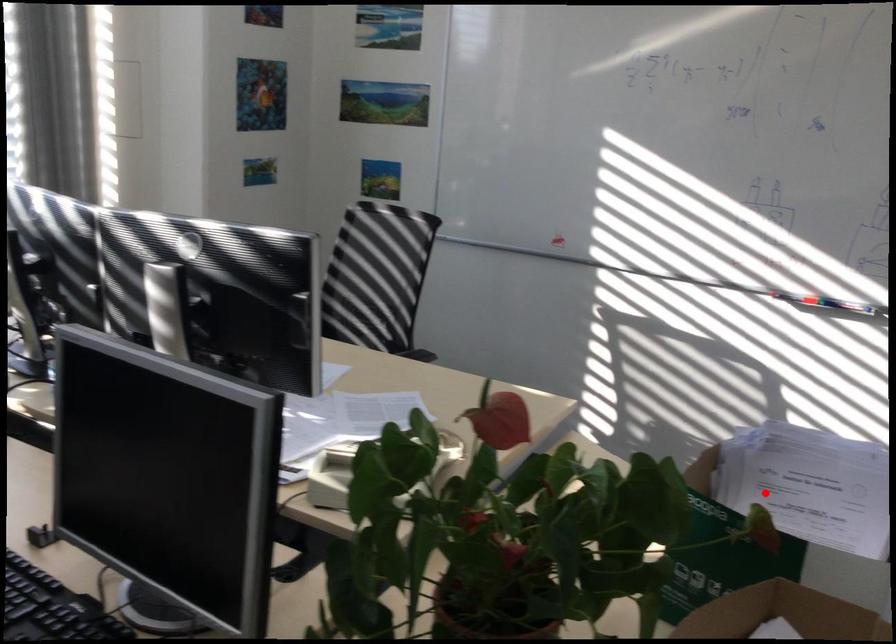
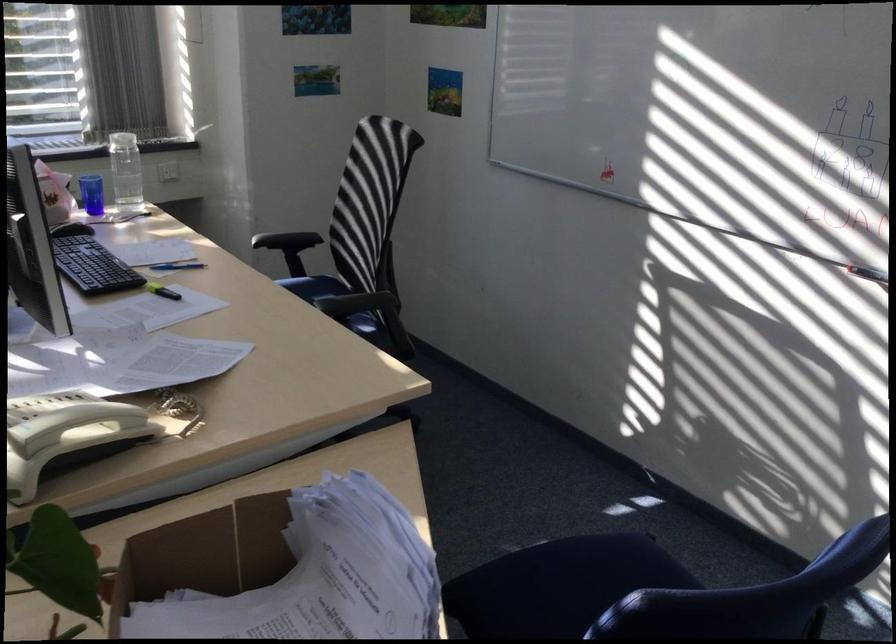
Question: I am providing you with two images of the same scene from different viewpoints. A red point is marked on the first image. Can you still see the location of the red point in image 2?

Choices:
 (A) Yes
 (B) No

Answer: (A)